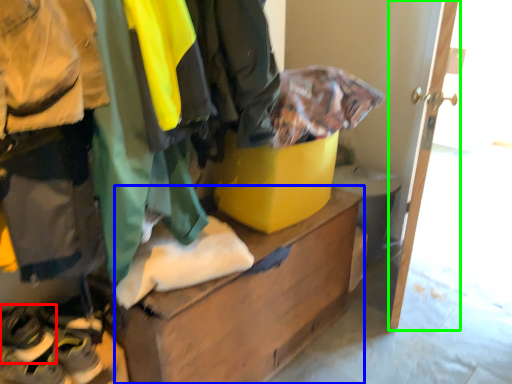
Question: Considering the real-world distances, which object is closest to footwear (highlighted by a red box)? furniture (highlighted by a blue box) or door (highlighted by a green box).

Choices:
 (A) furniture
 (B) door

Answer: (A)